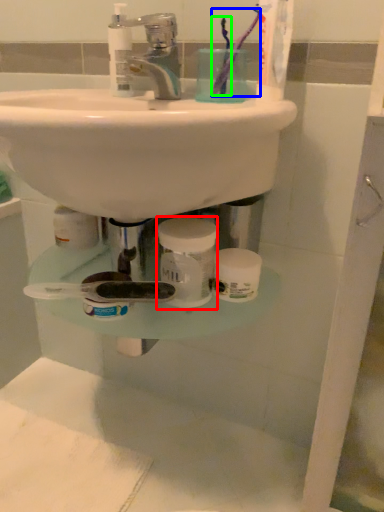
Question: Which object is the closest to the mouthwash (highlighted by a red box)? Choose among these: toothbrush (highlighted by a blue box) or toothbrush (highlighted by a green box).

Choices:
 (A) toothbrush
 (B) toothbrush

Answer: (B)